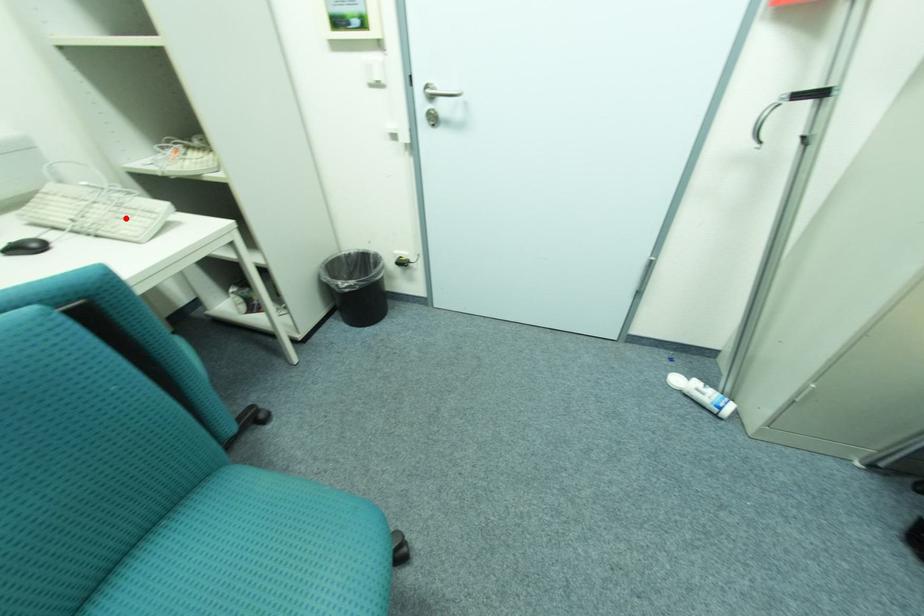
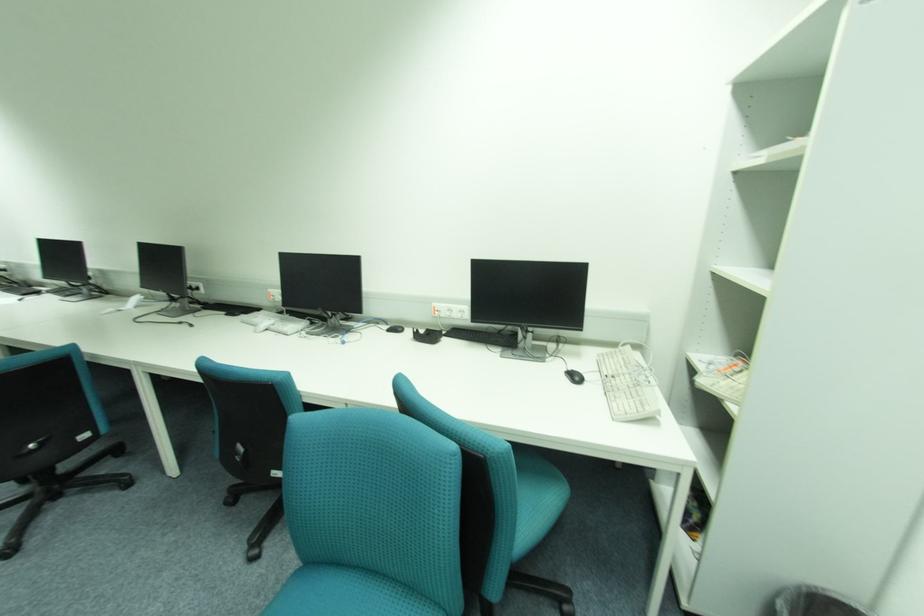
The point at the highlighted location is marked in the first image. Where is the corresponding point in the second image?

(631, 392)